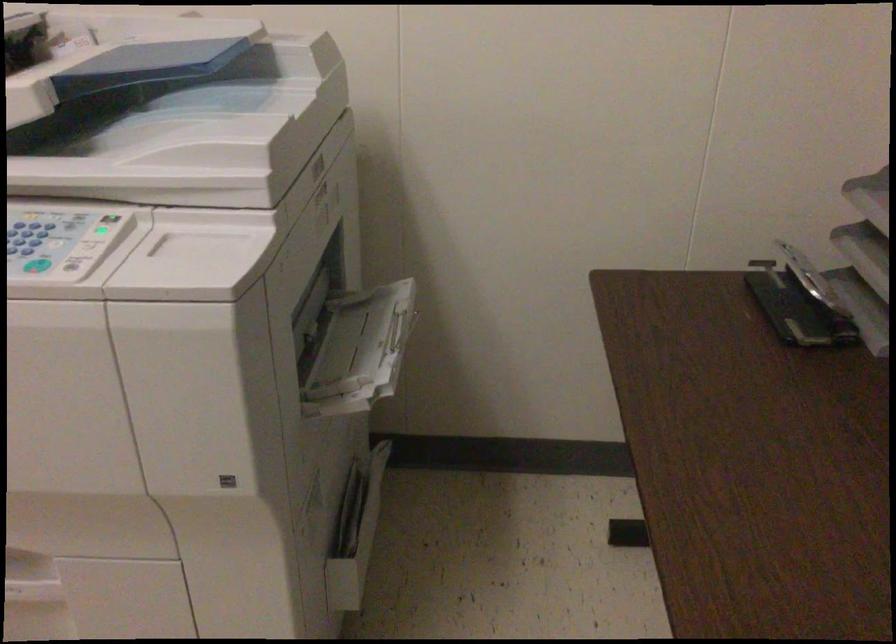
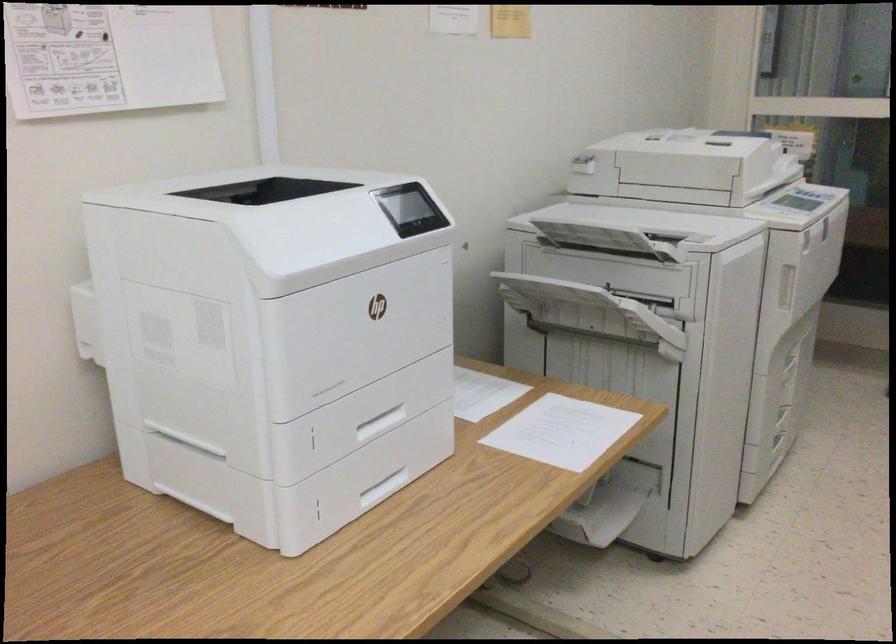
Question: I am providing you with two images of the same scene from different viewpoints. After the viewpoint changes to image2, which objects are now occluded?

Choices:
 (A) printer scanner lid
 (B) printer tray handle
 (C) yellow bucket
 (D) scanner lid

Answer: (A)